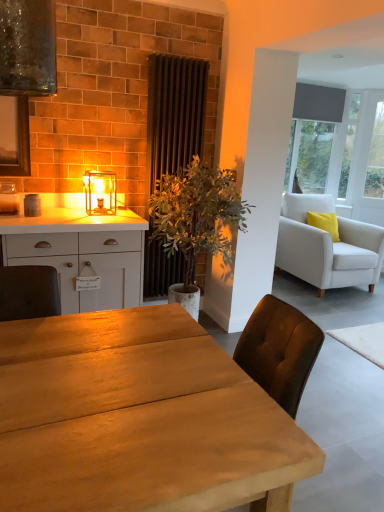
At what (x,y) coordinates should I click in order to perform the action: click on free spot above wooden table at center (from a real-world perspective). Please return your answer as a coordinate pair (x, y). The image size is (384, 512). Looking at the image, I should click on (134, 371).